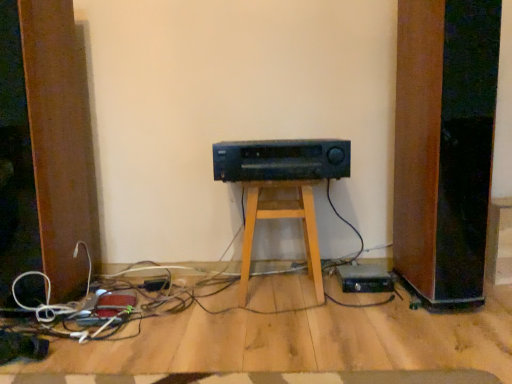
At what (x,y) coordinates should I click in order to perform the action: click on free space to the left of wooden stool at center. Please return your answer as a coordinate pair (x, y). Looking at the image, I should click on (204, 288).